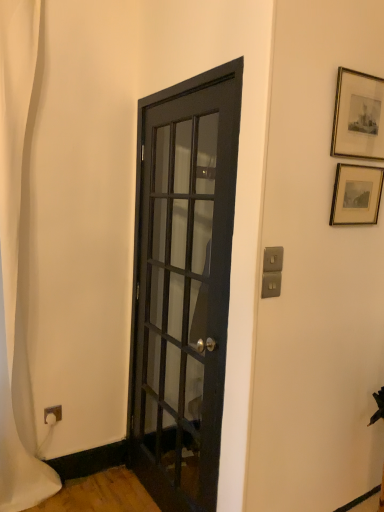
Question: From their relative heights in the image, would you say gold-framed picture at upper right, which is the first picture frame from bottom to top, is taller or shorter than gold-framed print at upper right, which is the first picture frame from top to bottom?

Choices:
 (A) short
 (B) tall

Answer: (A)

Question: Considering their positions, is gold-framed picture at upper right, which appears as the second picture frame when viewed from the top, located in front of or behind gold-framed print at upper right, the second picture frame in the bottom-to-top sequence?

Choices:
 (A) behind
 (B) front

Answer: (A)

Question: Which object is positioned farthest from the gold-framed picture at upper right, which is the first picture frame from bottom to top?

Choices:
 (A) white fabric shower curtain at left
 (B) gold-framed print at upper right, the second picture frame in the bottom-to-top sequence
 (C) matte black door at center

Answer: (A)

Question: Based on their relative distances, which object is nearer to the white fabric shower curtain at left?

Choices:
 (A) gold-framed print at upper right, the second picture frame in the bottom-to-top sequence
 (B) matte black door at center
 (C) gold-framed picture at upper right, which is the first picture frame from bottom to top

Answer: (B)